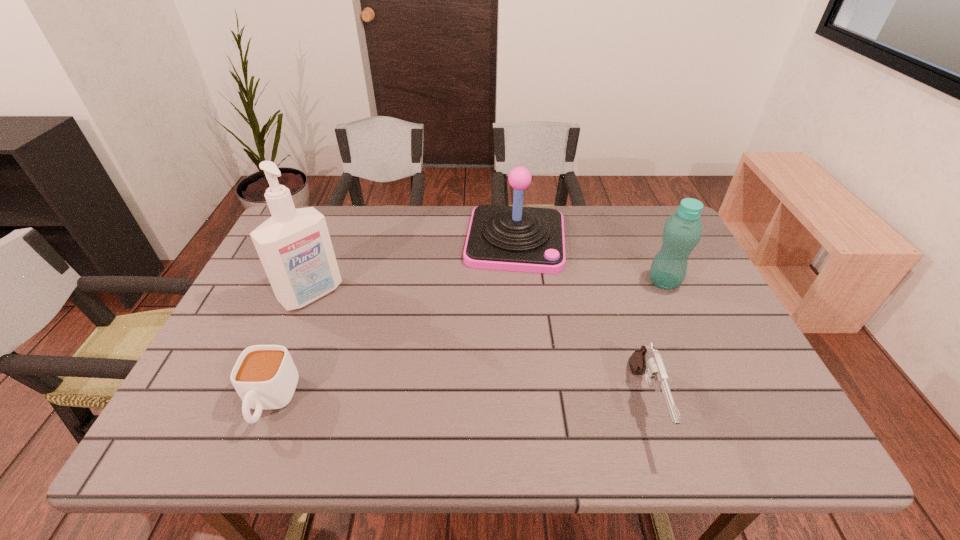
Identify the location of vacant space in between the fourth tallest object and the joystick. (581, 322).

The image size is (960, 540). I want to click on free space between the water bottle and the tallest object, so click(x=488, y=288).

Where is `free space between the third object from left to right and the water bottle`? The image size is (960, 540). free space between the third object from left to right and the water bottle is located at coordinates (589, 261).

The height and width of the screenshot is (540, 960). What are the coordinates of `vacant region between the rightmost object and the third object from left to right` in the screenshot? It's located at (589, 261).

Where is `free area in between the gun and the water bottle`? The height and width of the screenshot is (540, 960). free area in between the gun and the water bottle is located at coordinates (655, 343).

Locate an element on the screen. Image resolution: width=960 pixels, height=540 pixels. empty space between the fourth object from left to right and the rightmost object is located at coordinates 655,343.

This screenshot has height=540, width=960. Identify the location of object that is the second closest to the tallest object. (511, 238).

Identify which object is the closest to the cup. Please provide its 2D coordinates. Your answer should be formatted as a tuple, i.e. [(x, y)], where the tuple contains the x and y coordinates of a point satisfying the conditions above.

[(294, 245)]